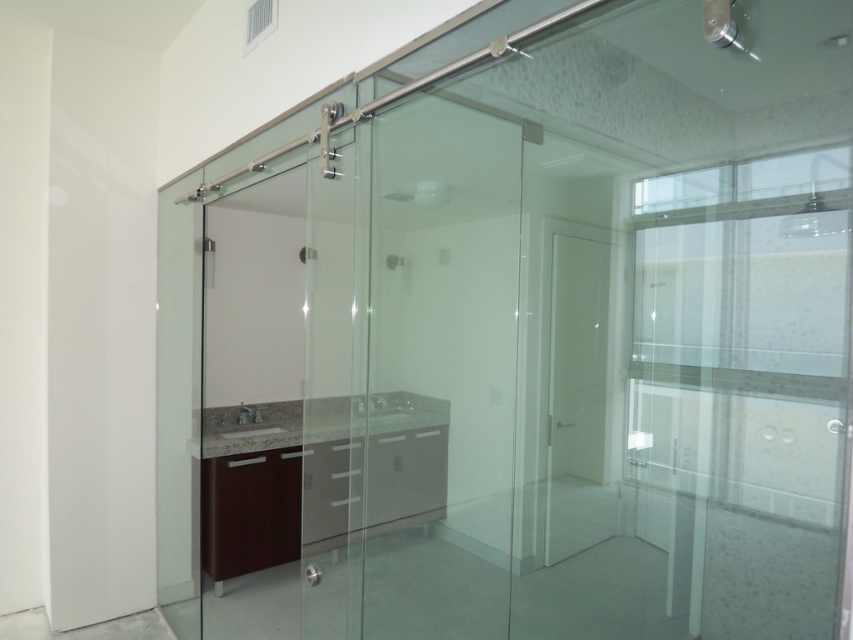
You are trying to enter the walk in shower but need to pass through the bathroom. Which object should you move first, the white matte door at center or the clear glass shower at center?

The white matte door at center is positioned under clear glass shower at center, so you should move the white matte door at center first to access the shower area.

You need to determine which object is taller between the white matte door at center and the clear glass shower at center in the bathroom. Based on the scene description, which one is taller?

The white matte door at center is much taller than the clear glass shower at center according to the description.